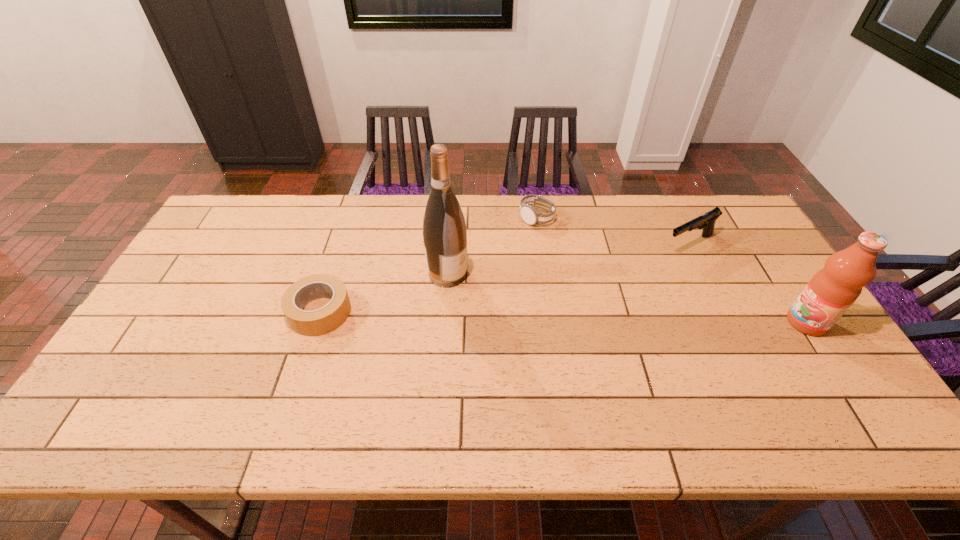
The height and width of the screenshot is (540, 960). In order to click on free space between the third shortest object and the third nearest object in this screenshot , I will do `click(568, 259)`.

You are a GUI agent. You are given a task and a screenshot of the screen. Output one action in this format:
    pyautogui.click(x=<x>, y=<y>)
    Task: Click on the free space between the wine bottle and the rightmost object
    The image size is (960, 540).
    Given the screenshot: What is the action you would take?
    pyautogui.click(x=627, y=298)

Locate an element on the screen. The width and height of the screenshot is (960, 540). vacant point located between the farthest object and the fruit juice is located at coordinates (671, 270).

Locate an element on the screen. Image resolution: width=960 pixels, height=540 pixels. vacant area that lies between the wine bottle and the farthest object is located at coordinates (492, 246).

You are a GUI agent. You are given a task and a screenshot of the screen. Output one action in this format:
    pyautogui.click(x=<x>, y=<y>)
    Task: Click on the vacant space that's between the rightmost object and the second shortest object
    This screenshot has width=960, height=540.
    Given the screenshot: What is the action you would take?
    pyautogui.click(x=671, y=270)

The image size is (960, 540). What are the coordinates of `object that is the fourth closest one to the rightmost object` in the screenshot? It's located at (317, 322).

The image size is (960, 540). Identify the location of the fourth closest object to the duct tape. (832, 290).

Find the location of a particular element. The image size is (960, 540). free space that satisfies the following two spatial constraints: 1. on the back side of the second object from right to left; 2. on the right side of the tallest object is located at coordinates (450, 244).

Find the location of a particular element. vacant space that satisfies the following two spatial constraints: 1. on the back side of the gun; 2. on the right side of the wine bottle is located at coordinates (450, 244).

Image resolution: width=960 pixels, height=540 pixels. In order to click on vacant space that satisfies the following two spatial constraints: 1. on the front side of the second object from right to left; 2. on the left side of the third object from left to right in this screenshot , I will do `click(540, 244)`.